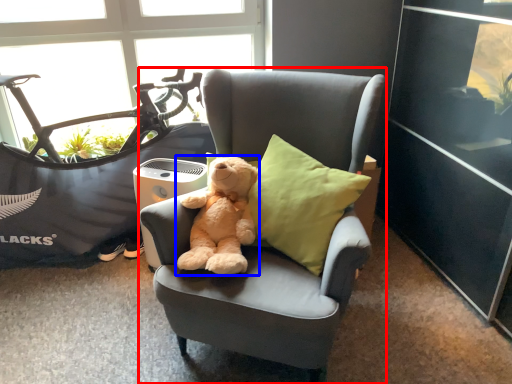
Question: Which of the following is the closest to the observer, chair (highlighted by a red box) or teddy bear (highlighted by a blue box)?

Choices:
 (A) chair
 (B) teddy bear

Answer: (A)